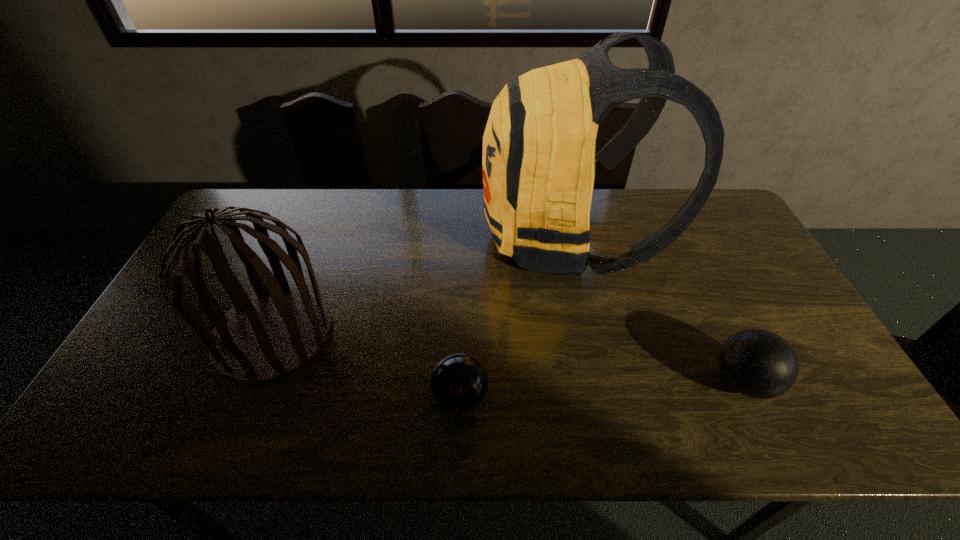
You are a GUI agent. You are given a task and a screenshot of the screen. Output one action in this format:
    pyautogui.click(x=<x>, y=<y>)
    Task: Click on the backpack
    
    Given the screenshot: What is the action you would take?
    pyautogui.click(x=538, y=164)

This screenshot has height=540, width=960. In order to click on birdcage in this screenshot , I will do `click(279, 328)`.

This screenshot has width=960, height=540. I want to click on the third shortest object, so click(x=279, y=328).

This screenshot has width=960, height=540. I want to click on the right bowling ball, so click(757, 363).

At what (x,y) coordinates should I click in order to perform the action: click on the third tallest object. Please return your answer as a coordinate pair (x, y). The height and width of the screenshot is (540, 960). Looking at the image, I should click on (757, 363).

The width and height of the screenshot is (960, 540). Identify the location of the shortest object. (459, 382).

Identify the location of the left bowling ball. (459, 382).

At what (x,y) coordinates should I click in order to perform the action: click on vacant space located 0.290m on the front-facing side of the backpack. Please return your answer as a coordinate pair (x, y). This screenshot has height=540, width=960. Looking at the image, I should click on (394, 238).

I want to click on free space located on the front-facing side of the backpack, so click(x=424, y=238).

The height and width of the screenshot is (540, 960). Find the location of `free space located 0.340m on the front-facing side of the backpack`. free space located 0.340m on the front-facing side of the backpack is located at coordinates (378, 238).